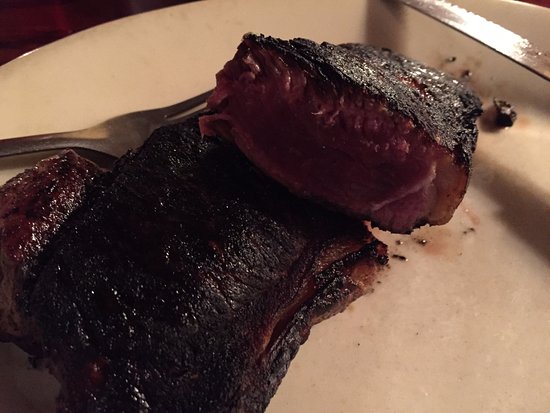
The width and height of the screenshot is (550, 413). In order to click on shadow on plate in this screenshot , I will do `click(533, 207)`, `click(386, 26)`, `click(16, 375)`.